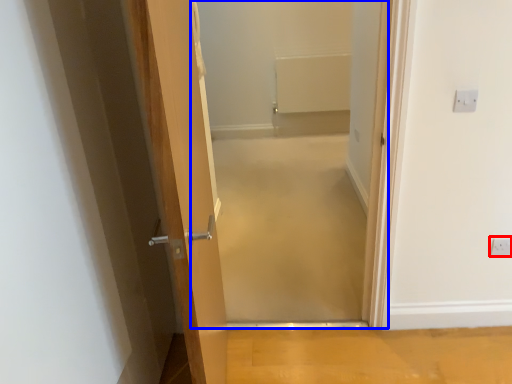
Question: Which point is further to the camera, electric outlet (highlighted by a red box) or corridor (highlighted by a blue box)?

Choices:
 (A) electric outlet
 (B) corridor

Answer: (A)